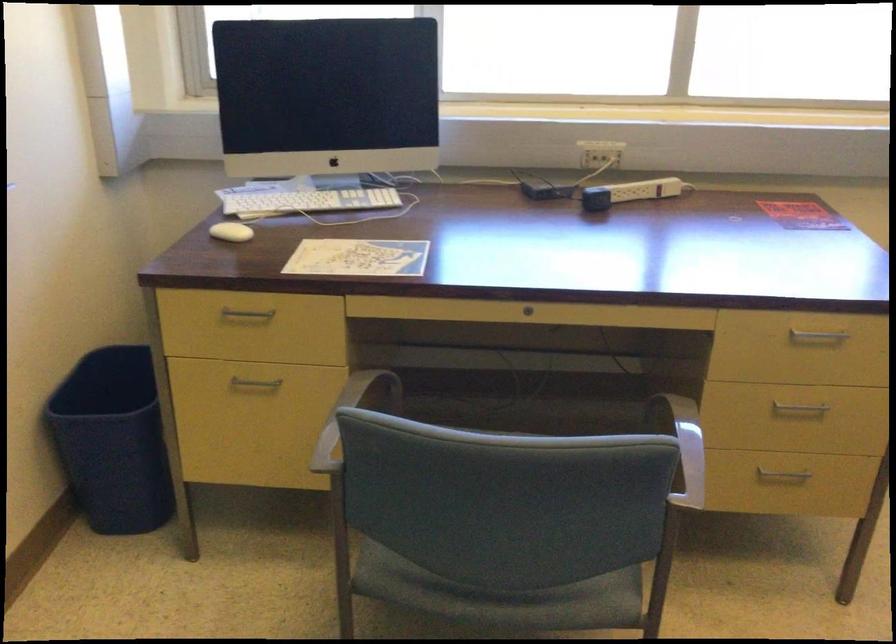
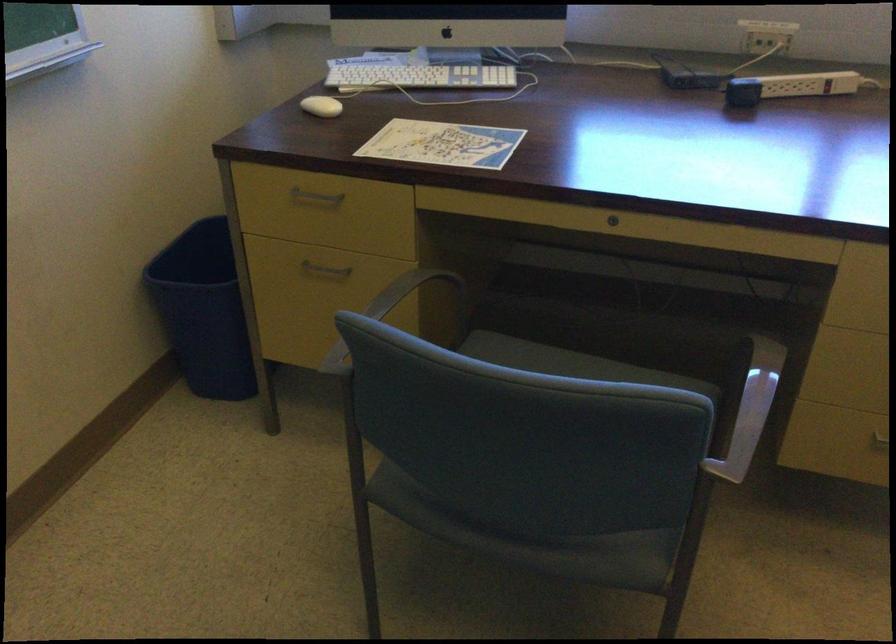
In the second image, find the point that corresponds to point (117, 442) in the first image.

(202, 310)